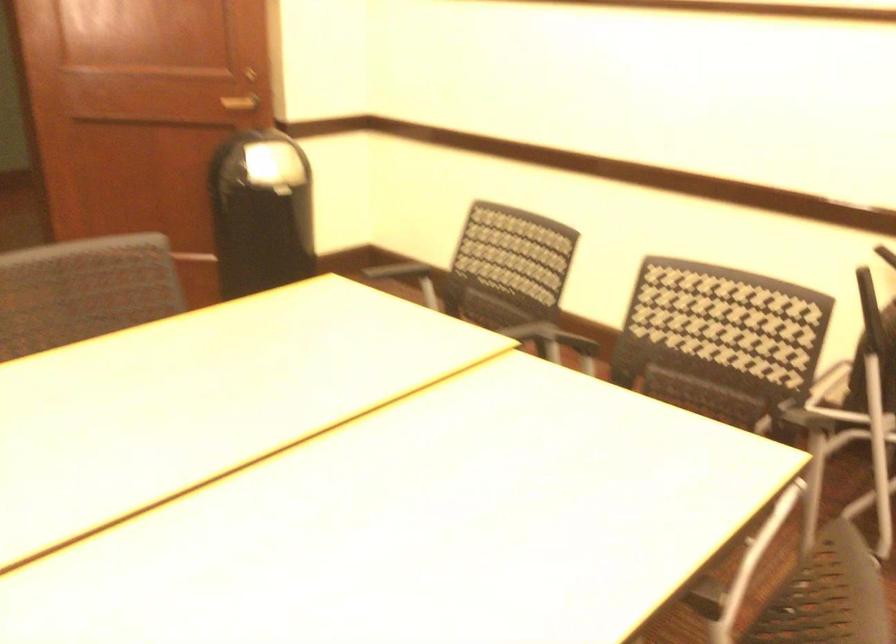
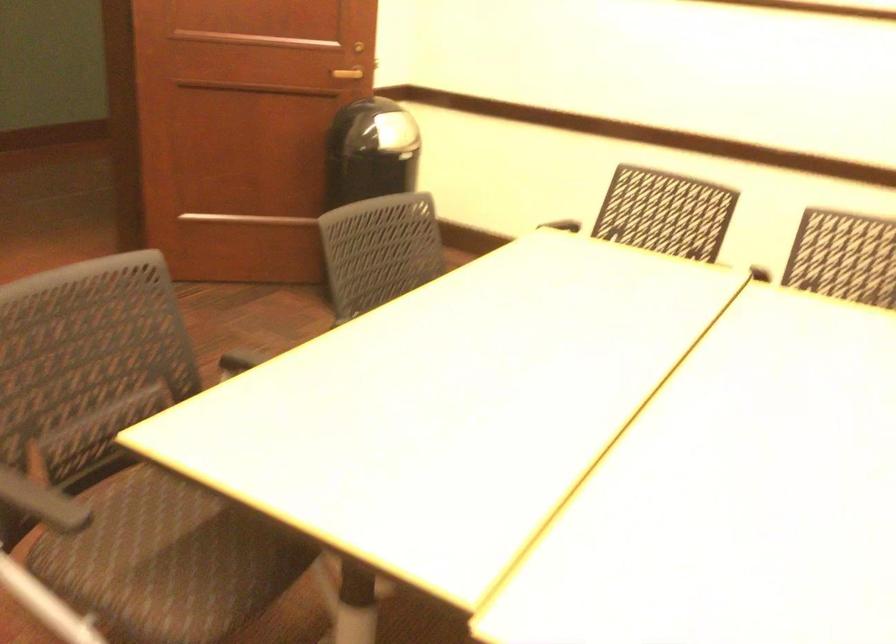
Question: Which direction would the cameraman need to move to produce the second image? Reply with the corresponding letter.

Choices:
 (A) Left
 (B) Right
 (C) Forward
 (D) Backward

Answer: (A)